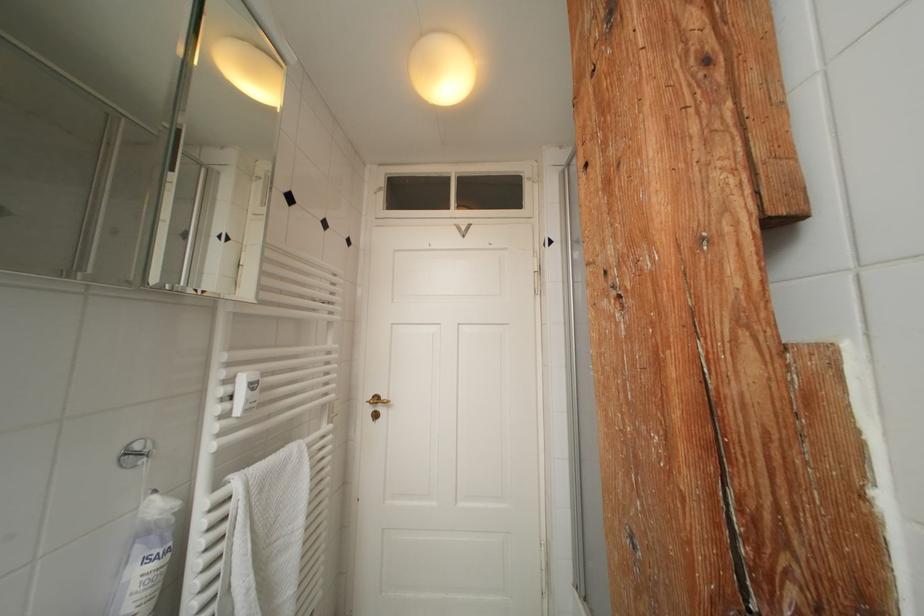
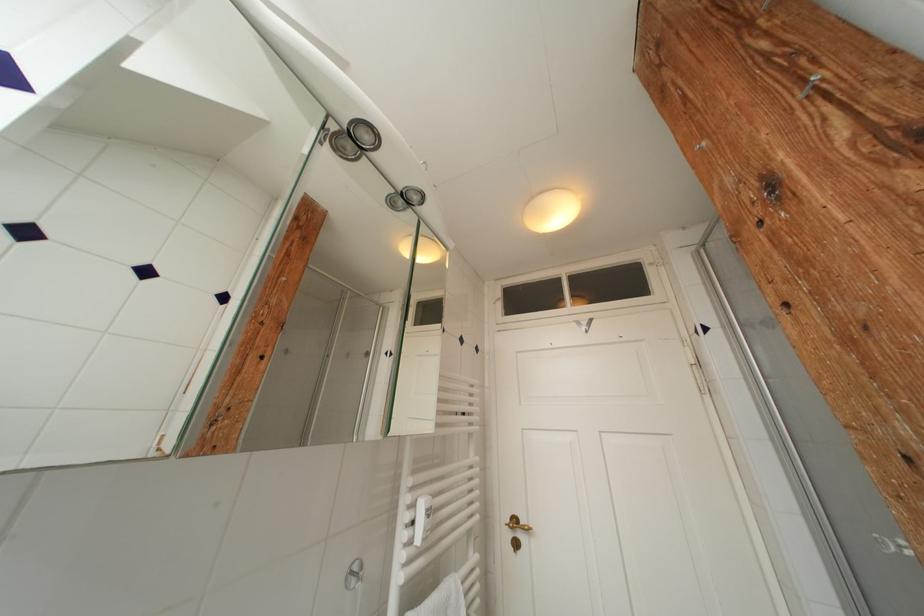
Where in the second image is the point corresponding to (x=337, y=315) from the first image?

(478, 427)